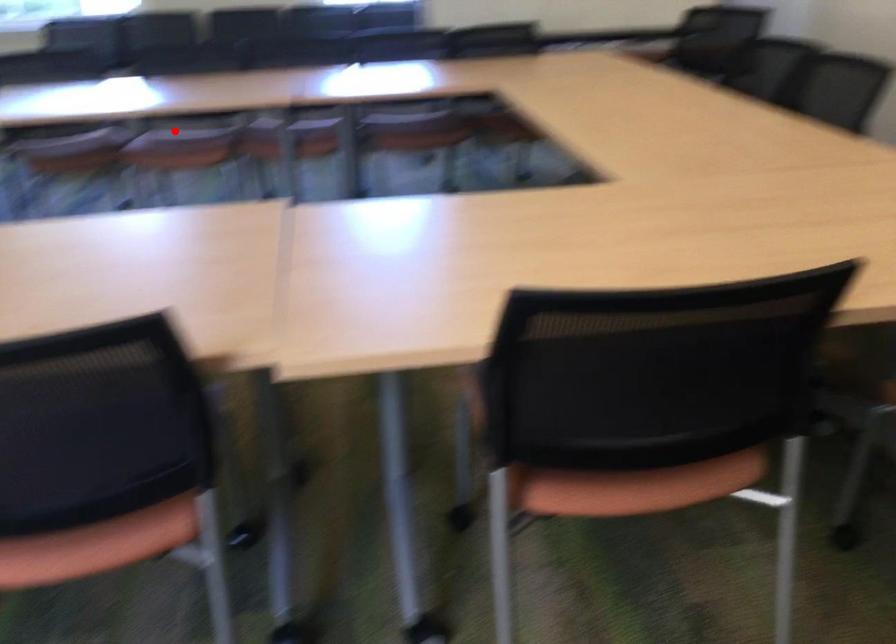
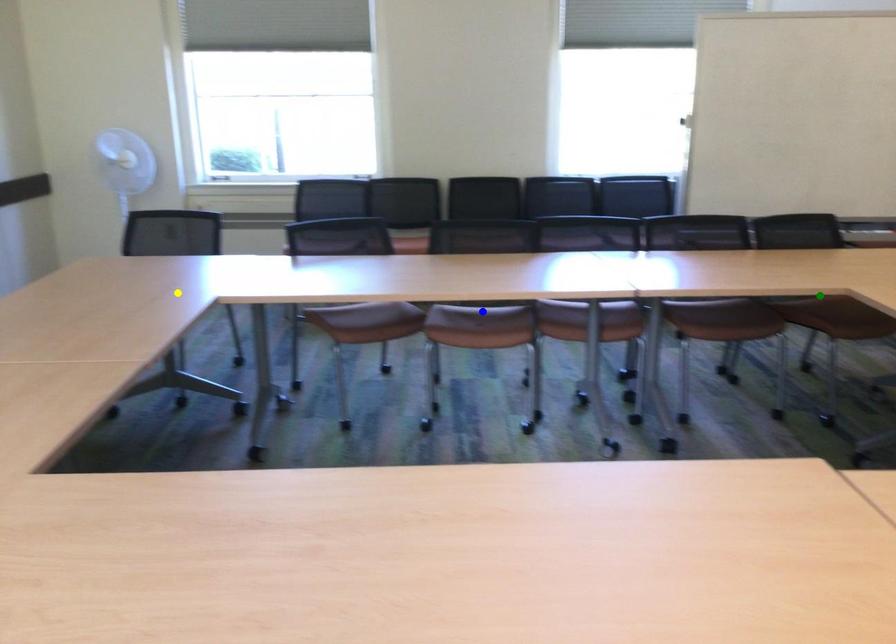
Question: I am providing you with two images of the same scene from different viewpoints. A red point is marked on the first image. You are given multiple points on the second image. Which point in image 2 is actually the same real-world point as the red point in image 1?

Choices:
 (A) green point
 (B) blue point
 (C) yellow point

Answer: (B)